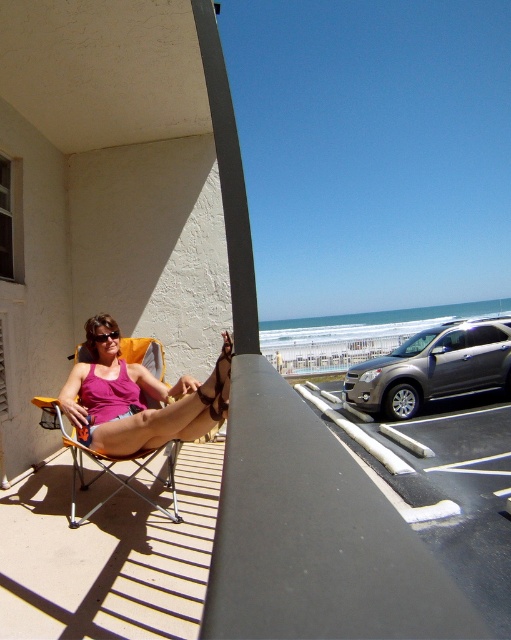
You are a fashion designer observing the scene. You notice the matte pink tank top at center and the orange fabric chair at center. Which item has a bigger size?

The matte pink tank top at center has a larger size compared to the orange fabric chair at center.